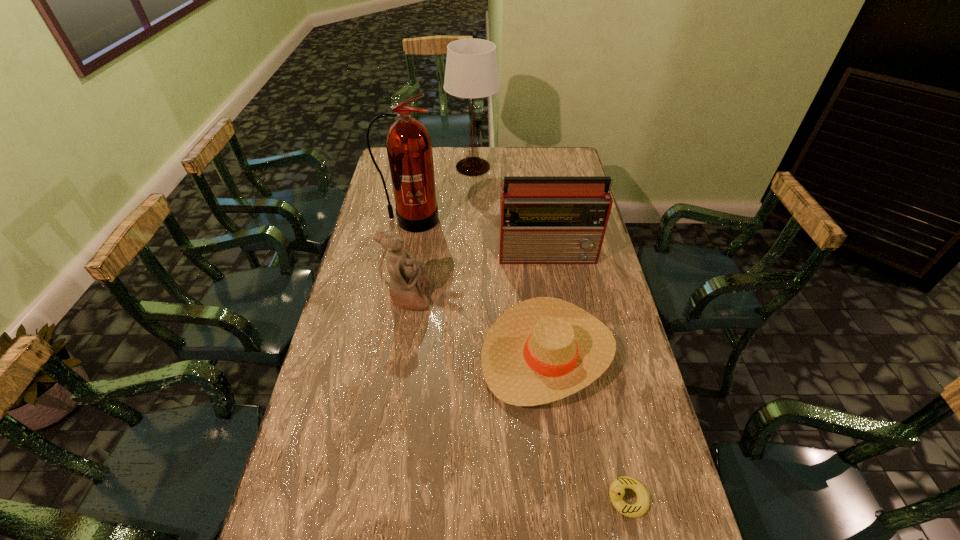
You are a GUI agent. You are given a task and a screenshot of the screen. Output one action in this format:
    pyautogui.click(x=<x>, y=<y>)
    Task: Click on the duckling that is at the right edge
    The image size is (960, 540).
    Given the screenshot: What is the action you would take?
    pyautogui.click(x=616, y=492)

Where is `free spot at the far edge of the desktop`? The width and height of the screenshot is (960, 540). free spot at the far edge of the desktop is located at coordinates (481, 152).

The height and width of the screenshot is (540, 960). In the image, there is a desktop. What are the coordinates of `vacant region at the left edge` in the screenshot? It's located at [x=374, y=247].

Where is `vacant space at the right edge of the desktop`? vacant space at the right edge of the desktop is located at coordinates (618, 443).

Find the location of a particular element. free space at the far right corner of the desktop is located at coordinates (570, 163).

At what (x,y) coordinates should I click in order to perform the action: click on vacant area that lies between the radio receiver and the second farthest object. Please return your answer as a coordinate pair (x, y). This screenshot has height=540, width=960. Looking at the image, I should click on (480, 237).

Where is `free spot between the fourth nearest object and the figurine`? free spot between the fourth nearest object and the figurine is located at coordinates (479, 275).

Identify the location of unoccupied area between the sunhat and the figurine. The width and height of the screenshot is (960, 540). click(478, 326).

Where is `empty location between the second shortest object and the third shortest object`? This screenshot has width=960, height=540. empty location between the second shortest object and the third shortest object is located at coordinates (478, 326).

Locate which object ranks fifth in proximity to the nearest object. Please provide its 2D coordinates. Your answer should be formatted as a tuple, i.e. [(x, y)], where the tuple contains the x and y coordinates of a point satisfying the conditions above.

[(471, 71)]